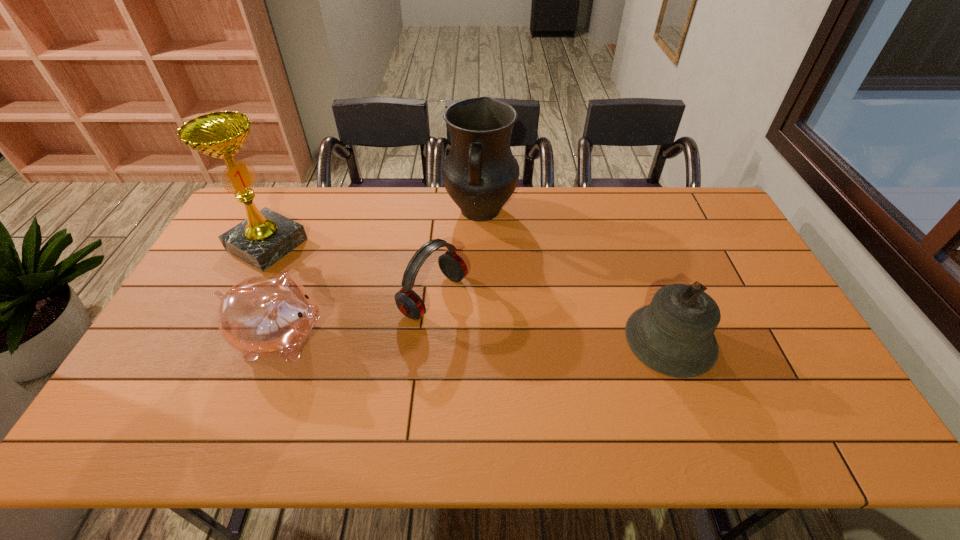
This screenshot has height=540, width=960. Identify the location of blank region between the bell and the earphone. (552, 318).

The height and width of the screenshot is (540, 960). I want to click on free space between the pitcher and the earphone, so click(457, 254).

Find the location of a particular element. The width and height of the screenshot is (960, 540). free area in between the earphone and the piggy bank is located at coordinates (358, 318).

You are a GUI agent. You are given a task and a screenshot of the screen. Output one action in this format:
    pyautogui.click(x=<x>, y=<y>)
    Task: Click on the vacant space that's between the piggy bank and the earphone
    This screenshot has height=540, width=960.
    Given the screenshot: What is the action you would take?
    click(x=358, y=318)

Identify the location of vacant space that's between the pitcher and the earphone. (457, 254).

Locate an element on the screen. vacant space that's between the earphone and the pitcher is located at coordinates (457, 254).

Identify which object is the third closest to the piggy bank. Please provide its 2D coordinates. Your answer should be formatted as a tuple, i.e. [(x, y)], where the tuple contains the x and y coordinates of a point satisfying the conditions above.

[(480, 173)]

Where is `object that is the third closest to the pitcher`? object that is the third closest to the pitcher is located at coordinates (272, 315).

You are a GUI agent. You are given a task and a screenshot of the screen. Output one action in this format:
    pyautogui.click(x=<x>, y=<y>)
    Task: Click on the vacant space that satisfies the following two spatial constraints: 1. on the front side of the earphone; 2. on the left side of the award
    
    Given the screenshot: What is the action you would take?
    pyautogui.click(x=242, y=296)

Identify the location of blank area in the image that satisfies the following two spatial constraints: 1. on the front side of the bell; 2. on the left side of the award. The height and width of the screenshot is (540, 960). (220, 340).